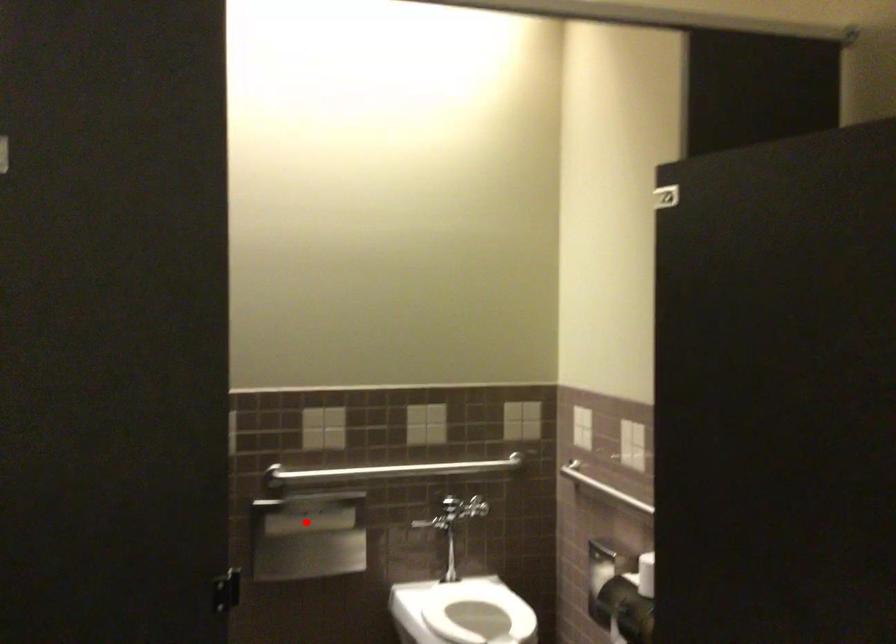
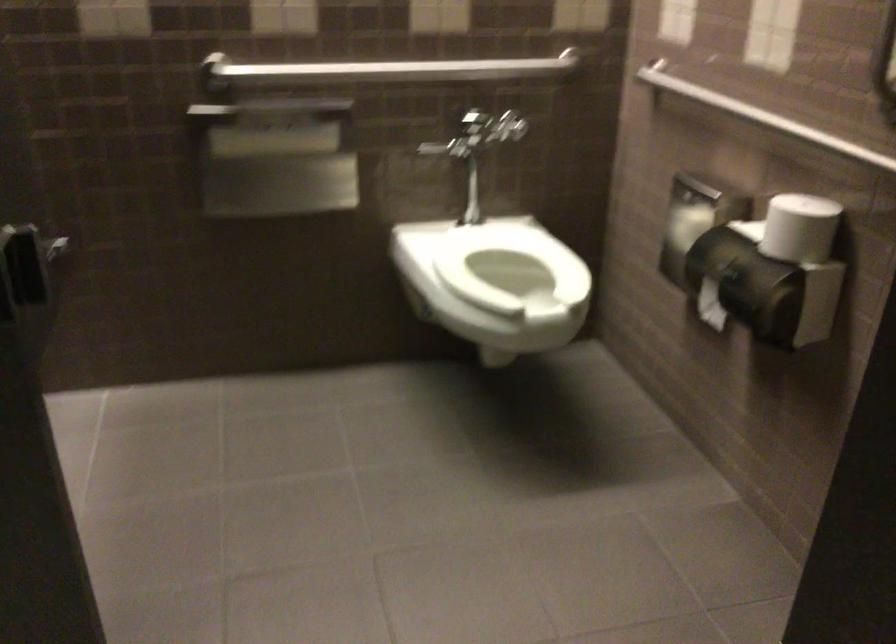
The point at the highlighted location is marked in the first image. Where is the corresponding point in the second image?

(273, 143)